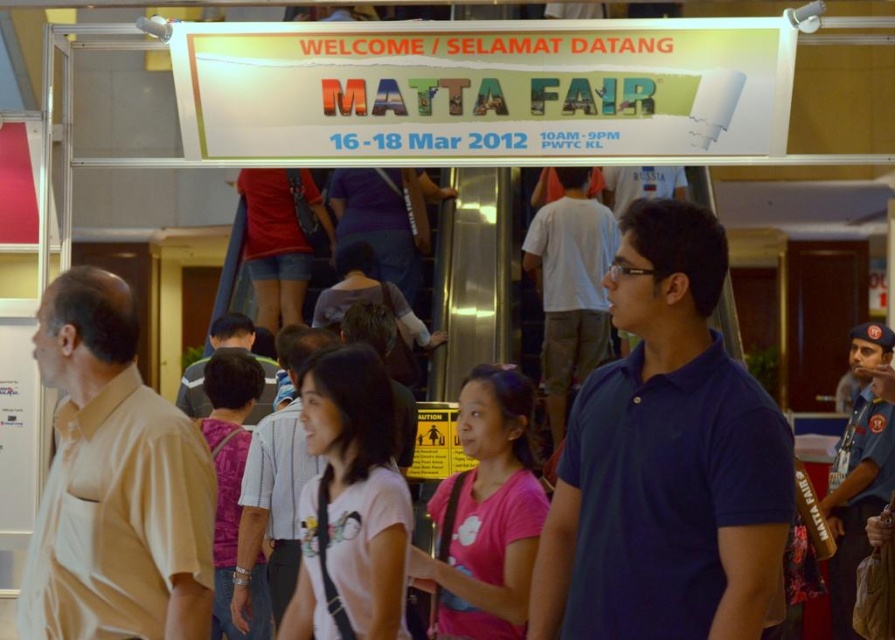
Question: Which point appears closest to the camera in this image?

Choices:
 (A) (590, 321)
 (B) (574, 552)
 (C) (271, 497)

Answer: (B)

Question: Which object appears closest to the camera in this image?

Choices:
 (A) dark blue polo shirt at center
 (B) beige cotton polo shirt at left
 (C) blue uniform at center

Answer: (A)

Question: Considering the relative positions of dark blue polo shirt at center and dark blue shirt at center in the image provided, where is dark blue polo shirt at center located with respect to dark blue shirt at center?

Choices:
 (A) above
 (B) below

Answer: (B)

Question: Is dark blue polo shirt at center behind blue uniform at center?

Choices:
 (A) yes
 (B) no

Answer: (B)

Question: From the image, what is the correct spatial relationship of beige cotton polo shirt at left in relation to white cotton shirt at center?

Choices:
 (A) below
 (B) above

Answer: (B)

Question: Based on their relative distances, which object is nearer to the white cotton shirt at center?

Choices:
 (A) dark blue polo shirt at center
 (B) striped shirt at center
 (C) beige cotton polo shirt at left

Answer: (C)